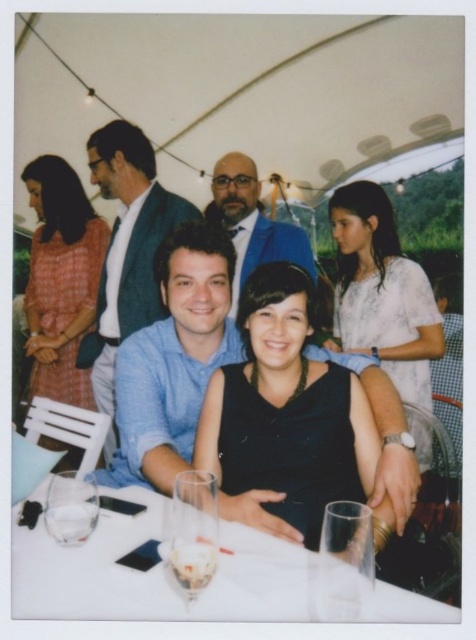
Which of these two, clear glassware at center or transparent glass at lower center, stands shorter?

Standing shorter between the two is clear glassware at center.

Can you confirm if clear glassware at center is smaller than transparent glass at lower center?

Actually, clear glassware at center might be larger than transparent glass at lower center.

Who is more distant from viewer, [212,604] or [337,547]?

The point [212,604] is more distant.

Identify the location of clear glassware at center. This screenshot has width=476, height=640. (157, 572).

Can you confirm if clear glassware at center is positioned below white textured blouse at upper right?

Yes, clear glassware at center is below white textured blouse at upper right.

Which is below, clear glassware at center or white textured blouse at upper right?

clear glassware at center is lower down.

This screenshot has height=640, width=476. What do you see at coordinates (157, 572) in the screenshot? I see `clear glassware at center` at bounding box center [157, 572].

Locate an element on the screen. The image size is (476, 640). clear glassware at center is located at coordinates (157, 572).

Does blue shirt at center have a greater height compared to orange plaid dress at left?

Correct, blue shirt at center is much taller as orange plaid dress at left.

Based on the photo, who is more distant from viewer, (142, 228) or (55, 384)?

Positioned behind is point (55, 384).

What are the coordinates of `blue shirt at center` in the screenshot? It's located at (127, 252).